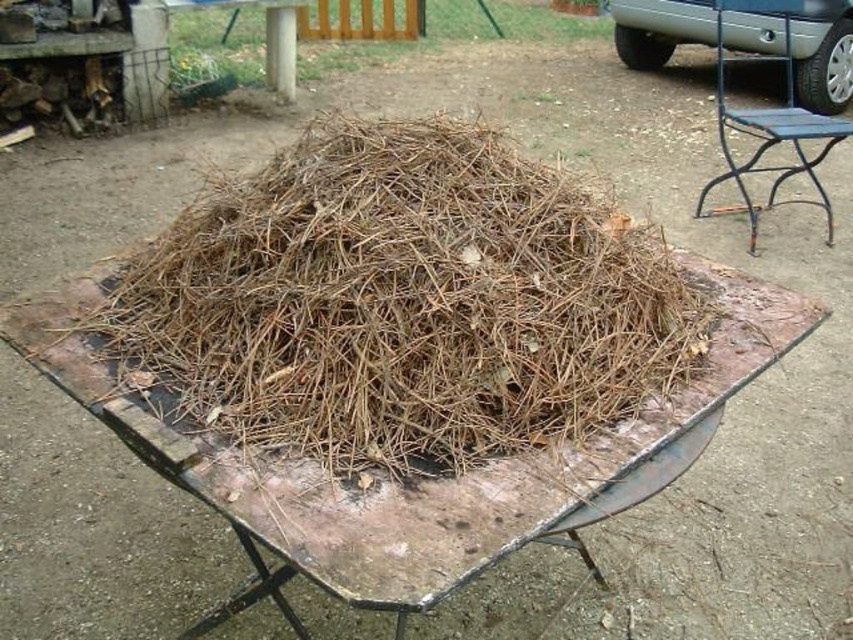
Question: In this image, where is brown dry hay at center located relative to black metal chair at right?

Choices:
 (A) below
 (B) above

Answer: (A)

Question: Which of the following is the farthest from the observer?

Choices:
 (A) brown dry hay at center
 (B) black metal chair at right

Answer: (B)

Question: Which object is farther from the camera taking this photo?

Choices:
 (A) brown dry hay at center
 (B) black metal chair at right

Answer: (B)

Question: Which object is closer to the camera taking this photo?

Choices:
 (A) black metal chair at right
 (B) brown dry hay at center

Answer: (B)

Question: Is brown dry hay at center bigger than black metal chair at right?

Choices:
 (A) no
 (B) yes

Answer: (A)

Question: Is brown dry hay at center positioned in front of black metal chair at right?

Choices:
 (A) yes
 (B) no

Answer: (A)